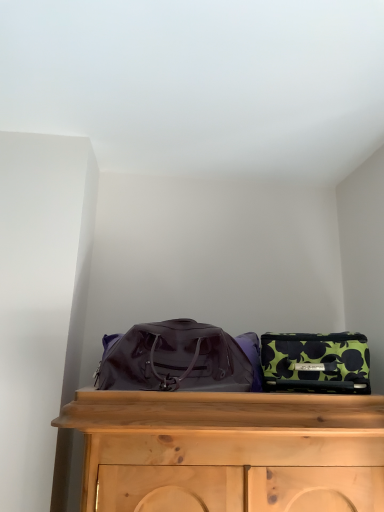
Find the location of a particular element. The height and width of the screenshot is (512, 384). green floral fabric bag at right, acting as the first luggage and bags starting from the right is located at coordinates (316, 362).

Measure the distance between point [297,387] and camera.

Point [297,387] and camera are 1.40 meters apart.

What do you see at coordinates (316, 362) in the screenshot? The width and height of the screenshot is (384, 512). I see `green floral fabric bag at right, marked as the second luggage and bags in a left-to-right arrangement` at bounding box center [316, 362].

Measure the distance between point (228,339) and camera.

Point (228,339) and camera are 1.55 meters apart.

How much space does glossy purple duffel bag at center, the 2th luggage and bags when ordered from right to left, occupy vertically?

glossy purple duffel bag at center, the 2th luggage and bags when ordered from right to left, is 10.15 inches in height.

You are a GUI agent. You are given a task and a screenshot of the screen. Output one action in this format:
    pyautogui.click(x=<x>, y=<y>)
    Task: Click on the glossy purple duffel bag at center, which is the first luggage and bags in left-to-right order
    This screenshot has height=512, width=384.
    Given the screenshot: What is the action you would take?
    pyautogui.click(x=177, y=360)

Describe the element at coordinates (177, 360) in the screenshot. I see `glossy purple duffel bag at center, the 2th luggage and bags when ordered from right to left` at that location.

Locate an element on the screen. The height and width of the screenshot is (512, 384). green floral fabric bag at right, marked as the second luggage and bags in a left-to-right arrangement is located at coordinates (316, 362).

Can you confirm if glossy purple duffel bag at center, which is the first luggage and bags in left-to-right order, is positioned to the right of green floral fabric bag at right, marked as the second luggage and bags in a left-to-right arrangement?

No.

Is glossy purple duffel bag at center, the 2th luggage and bags when ordered from right to left, positioned before green floral fabric bag at right, marked as the second luggage and bags in a left-to-right arrangement?

Yes, it is.

Does point (178, 359) come behind point (267, 359)?

Yes, it is behind point (267, 359).

From the image's perspective, who appears lower, glossy purple duffel bag at center, the 2th luggage and bags when ordered from right to left, or green floral fabric bag at right, marked as the second luggage and bags in a left-to-right arrangement?

green floral fabric bag at right, marked as the second luggage and bags in a left-to-right arrangement, appears lower in the image.

From a real-world perspective, which object stands above the other?

glossy purple duffel bag at center, which is the first luggage and bags in left-to-right order.

Does glossy purple duffel bag at center, which is the first luggage and bags in left-to-right order, have a lesser width compared to green floral fabric bag at right, marked as the second luggage and bags in a left-to-right arrangement?

In fact, glossy purple duffel bag at center, which is the first luggage and bags in left-to-right order, might be wider than green floral fabric bag at right, marked as the second luggage and bags in a left-to-right arrangement.

Between glossy purple duffel bag at center, which is the first luggage and bags in left-to-right order, and green floral fabric bag at right, acting as the first luggage and bags starting from the right, which one has less height?

green floral fabric bag at right, acting as the first luggage and bags starting from the right, is shorter.

In the scene shown: Is glossy purple duffel bag at center, the 2th luggage and bags when ordered from right to left, bigger than green floral fabric bag at right, acting as the first luggage and bags starting from the right?

Correct, glossy purple duffel bag at center, the 2th luggage and bags when ordered from right to left, is larger in size than green floral fabric bag at right, acting as the first luggage and bags starting from the right.

Can we say glossy purple duffel bag at center, the 2th luggage and bags when ordered from right to left, lies outside green floral fabric bag at right, acting as the first luggage and bags starting from the right?

Yes, glossy purple duffel bag at center, the 2th luggage and bags when ordered from right to left, is located beyond the bounds of green floral fabric bag at right, acting as the first luggage and bags starting from the right.

Is glossy purple duffel bag at center, the 2th luggage and bags when ordered from right to left, not near green floral fabric bag at right, acting as the first luggage and bags starting from the right?

glossy purple duffel bag at center, the 2th luggage and bags when ordered from right to left, is actually quite close to green floral fabric bag at right, acting as the first luggage and bags starting from the right.

Consider the image. Is glossy purple duffel bag at center, which is the first luggage and bags in left-to-right order, facing towards green floral fabric bag at right, marked as the second luggage and bags in a left-to-right arrangement?

No.

Locate an element on the screen. This screenshot has width=384, height=512. luggage and bags on the right side of glossy purple duffel bag at center, the 2th luggage and bags when ordered from right to left is located at coordinates (316, 362).

Is green floral fabric bag at right, marked as the second luggage and bags in a left-to-right arrangement, to the left or to the right of glossy purple duffel bag at center, the 2th luggage and bags when ordered from right to left, in the image?

In the image, green floral fabric bag at right, marked as the second luggage and bags in a left-to-right arrangement, appears on the right side of glossy purple duffel bag at center, the 2th luggage and bags when ordered from right to left.

Considering the positions of objects green floral fabric bag at right, acting as the first luggage and bags starting from the right, and glossy purple duffel bag at center, the 2th luggage and bags when ordered from right to left, in the image provided, who is behind, green floral fabric bag at right, acting as the first luggage and bags starting from the right, or glossy purple duffel bag at center, the 2th luggage and bags when ordered from right to left,?

green floral fabric bag at right, acting as the first luggage and bags starting from the right.

Does point (324, 341) appear closer or farther from the camera than point (180, 369)?

Point (324, 341) is positioned closer to the camera compared to point (180, 369).

From the image's perspective, which one is positioned higher, green floral fabric bag at right, acting as the first luggage and bags starting from the right, or glossy purple duffel bag at center, the 2th luggage and bags when ordered from right to left?

glossy purple duffel bag at center, the 2th luggage and bags when ordered from right to left, appears higher in the image.

From a real-world perspective, is green floral fabric bag at right, acting as the first luggage and bags starting from the right, above or below glossy purple duffel bag at center, the 2th luggage and bags when ordered from right to left?

green floral fabric bag at right, acting as the first luggage and bags starting from the right, is below glossy purple duffel bag at center, the 2th luggage and bags when ordered from right to left.

Does green floral fabric bag at right, marked as the second luggage and bags in a left-to-right arrangement, have a greater width compared to glossy purple duffel bag at center, which is the first luggage and bags in left-to-right order?

No, green floral fabric bag at right, marked as the second luggage and bags in a left-to-right arrangement, is not wider than glossy purple duffel bag at center, which is the first luggage and bags in left-to-right order.

Which of these two, green floral fabric bag at right, marked as the second luggage and bags in a left-to-right arrangement, or glossy purple duffel bag at center, which is the first luggage and bags in left-to-right order, stands shorter?

green floral fabric bag at right, marked as the second luggage and bags in a left-to-right arrangement, is shorter.

Considering the relative sizes of green floral fabric bag at right, acting as the first luggage and bags starting from the right, and glossy purple duffel bag at center, the 2th luggage and bags when ordered from right to left, in the image provided, is green floral fabric bag at right, acting as the first luggage and bags starting from the right, bigger than glossy purple duffel bag at center, the 2th luggage and bags when ordered from right to left,?

Actually, green floral fabric bag at right, acting as the first luggage and bags starting from the right, might be smaller than glossy purple duffel bag at center, the 2th luggage and bags when ordered from right to left.

Is glossy purple duffel bag at center, the 2th luggage and bags when ordered from right to left, surrounded by green floral fabric bag at right, acting as the first luggage and bags starting from the right?

No, glossy purple duffel bag at center, the 2th luggage and bags when ordered from right to left, is located outside of green floral fabric bag at right, acting as the first luggage and bags starting from the right.

Is green floral fabric bag at right, acting as the first luggage and bags starting from the right, in contact with glossy purple duffel bag at center, which is the first luggage and bags in left-to-right order?

No, green floral fabric bag at right, acting as the first luggage and bags starting from the right, is not making contact with glossy purple duffel bag at center, which is the first luggage and bags in left-to-right order.

Could you tell me if green floral fabric bag at right, acting as the first luggage and bags starting from the right, is facing glossy purple duffel bag at center, the 2th luggage and bags when ordered from right to left?

No, green floral fabric bag at right, acting as the first luggage and bags starting from the right, does not turn towards glossy purple duffel bag at center, the 2th luggage and bags when ordered from right to left.

What's the angular difference between green floral fabric bag at right, acting as the first luggage and bags starting from the right, and glossy purple duffel bag at center, the 2th luggage and bags when ordered from right to left,'s facing directions?

The facing directions of green floral fabric bag at right, acting as the first luggage and bags starting from the right, and glossy purple duffel bag at center, the 2th luggage and bags when ordered from right to left, are 0.00191 degrees apart.

Measure the distance between green floral fabric bag at right, acting as the first luggage and bags starting from the right, and glossy purple duffel bag at center, which is the first luggage and bags in left-to-right order.

green floral fabric bag at right, acting as the first luggage and bags starting from the right, and glossy purple duffel bag at center, which is the first luggage and bags in left-to-right order, are 9.80 inches apart from each other.

Where is `luggage and bags in front of the green floral fabric bag at right, marked as the second luggage and bags in a left-to-right arrangement`? The height and width of the screenshot is (512, 384). luggage and bags in front of the green floral fabric bag at right, marked as the second luggage and bags in a left-to-right arrangement is located at coordinates (177, 360).

Where is `luggage and bags on the left of green floral fabric bag at right, marked as the second luggage and bags in a left-to-right arrangement`? This screenshot has height=512, width=384. luggage and bags on the left of green floral fabric bag at right, marked as the second luggage and bags in a left-to-right arrangement is located at coordinates (177, 360).

Where is `luggage and bags below the glossy purple duffel bag at center, which is the first luggage and bags in left-to-right order (from a real-world perspective)`? The image size is (384, 512). luggage and bags below the glossy purple duffel bag at center, which is the first luggage and bags in left-to-right order (from a real-world perspective) is located at coordinates (316, 362).